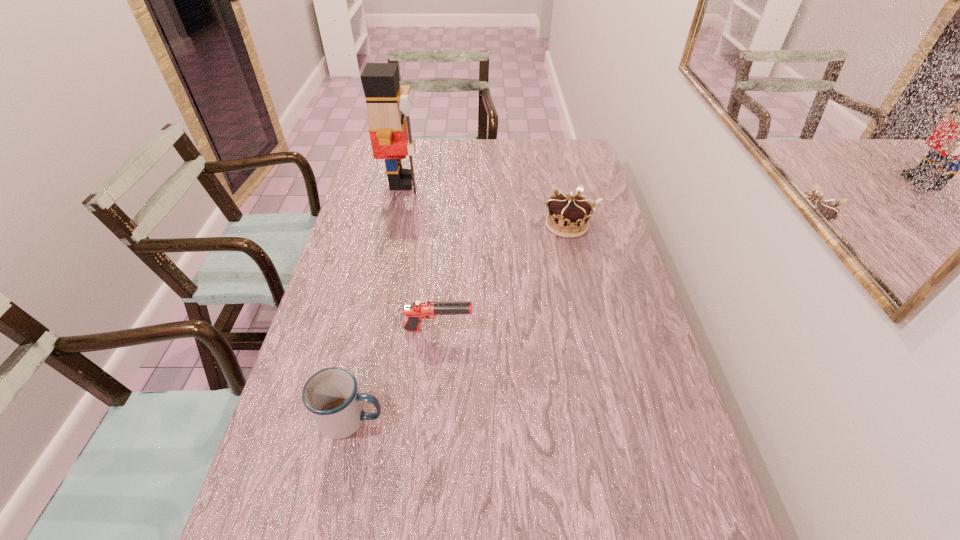
Locate an element on the screen. free point located 0.250m at the aiming end of the shortest object is located at coordinates (566, 330).

Where is `object situated at the far edge`? Image resolution: width=960 pixels, height=540 pixels. object situated at the far edge is located at coordinates (388, 105).

Identify the location of nutcracker that is at the left edge. (388, 105).

Identify the location of mug that is at the left edge. The height and width of the screenshot is (540, 960). click(331, 395).

Identify the location of object at the right edge. Image resolution: width=960 pixels, height=540 pixels. pyautogui.click(x=568, y=215).

At what (x,y) coordinates should I click in order to perform the action: click on object situated at the far left corner. Please return your answer as a coordinate pair (x, y). The image size is (960, 540). Looking at the image, I should click on (388, 105).

Locate an element on the screen. The width and height of the screenshot is (960, 540). vacant space at the far edge of the desktop is located at coordinates (505, 150).

You are a GUI agent. You are given a task and a screenshot of the screen. Output one action in this format:
    pyautogui.click(x=<x>, y=<y>)
    Task: Click on the free space at the left edge of the desktop
    The width and height of the screenshot is (960, 540).
    Given the screenshot: What is the action you would take?
    click(x=322, y=482)

Identify the location of vacant space at the right edge of the desktop. (633, 284).

In the image, there is a desktop. Find the location of `vacant space at the far left corner`. vacant space at the far left corner is located at coordinates (403, 164).